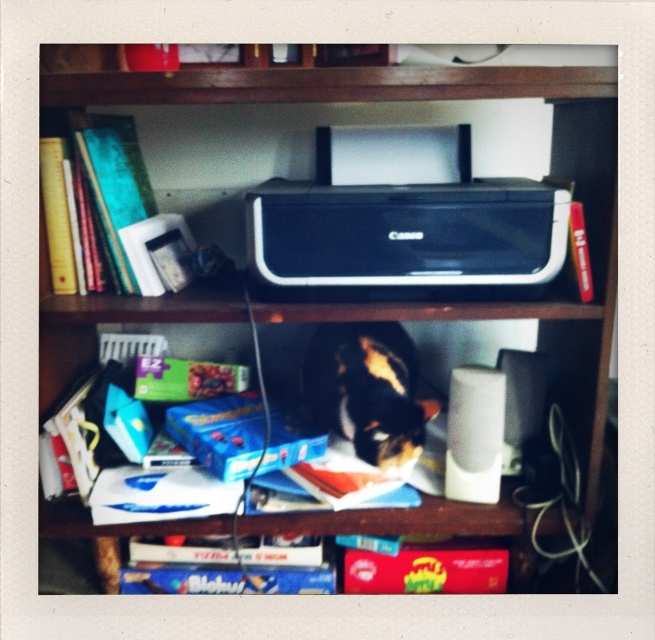
Can you confirm if calico fur cat at center is positioned below red matte book at center?

Actually, calico fur cat at center is above red matte book at center.

Consider the image. Is calico fur cat at center thinner than red matte book at center?

Yes, calico fur cat at center is thinner than red matte book at center.

Between point (383, 324) and point (407, 548), which one is positioned behind?

The point (383, 324) is more distant.

Find the location of `calico fur cat at center`. calico fur cat at center is located at coordinates (367, 392).

The width and height of the screenshot is (655, 640). What do you see at coordinates (113, 179) in the screenshot?
I see `teal matte book at upper left` at bounding box center [113, 179].

Is point (90, 182) positioned in front of point (569, 237)?

No, (90, 182) is behind (569, 237).

This screenshot has height=640, width=655. Find the location of `teal matte book at upper left`. teal matte book at upper left is located at coordinates (113, 179).

Does calico fur cat at center appear on the left side of matte black printer at upper center?

Correct, you'll find calico fur cat at center to the left of matte black printer at upper center.

Is point (407, 435) farther from camera compared to point (584, 298)?

Yes, point (407, 435) is farther from viewer.

This screenshot has height=640, width=655. Describe the element at coordinates (367, 392) in the screenshot. I see `calico fur cat at center` at that location.

Where is `calico fur cat at center`? This screenshot has width=655, height=640. calico fur cat at center is located at coordinates (367, 392).